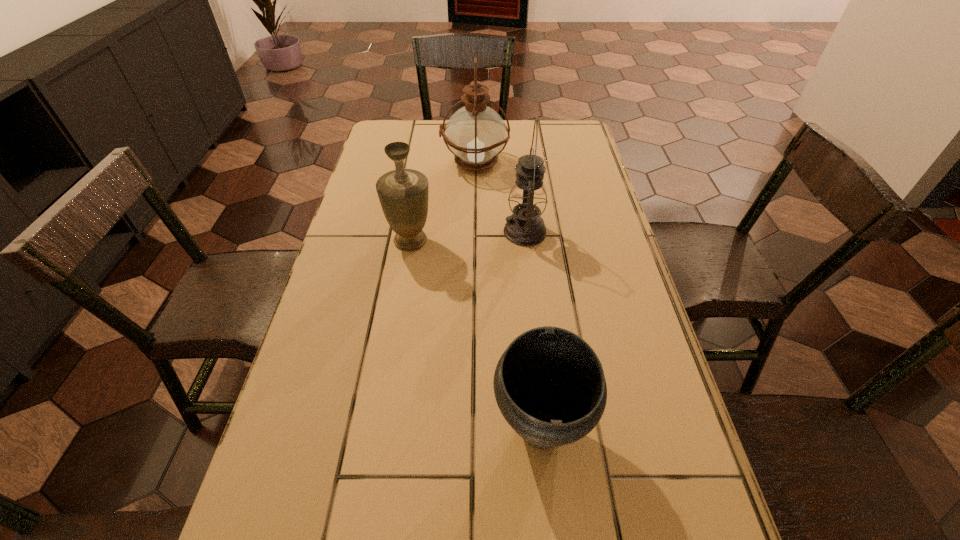
Find the location of `object that is at the far edge`. object that is at the far edge is located at coordinates (475, 134).

In order to click on object present at the left edge in this screenshot , I will do `click(403, 193)`.

I want to click on vacant space at the left edge of the desktop, so click(329, 449).

Where is `blank area at the right edge`? This screenshot has height=540, width=960. blank area at the right edge is located at coordinates (579, 307).

In the image, there is a desktop. In order to click on vacant space at the far left corner in this screenshot , I will do `click(415, 131)`.

In the image, there is a desktop. Identify the location of free space at the far right corner. (562, 142).

Image resolution: width=960 pixels, height=540 pixels. In order to click on free spot between the nearer oil lamp and the taller urn in this screenshot , I will do (468, 236).

I want to click on free spot between the nearer oil lamp and the farthest object, so click(500, 197).

Find the location of a particular element. The width and height of the screenshot is (960, 540). vacant area that lies between the farthest object and the shorter urn is located at coordinates (508, 296).

Identify the location of empty location between the farthest object and the third tallest object. (443, 202).